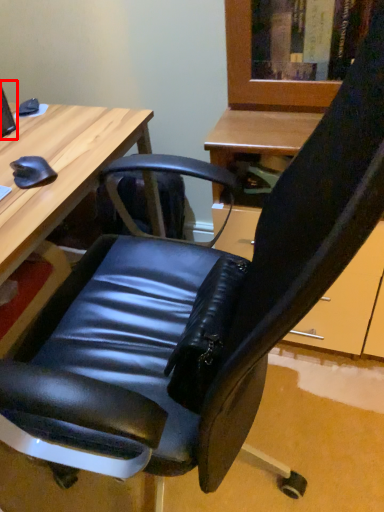
Question: Considering the relative positions of computer monitor (annotated by the red box) and desk in the image provided, where is computer monitor (annotated by the red box) located with respect to the staircase?

Choices:
 (A) right
 (B) left

Answer: (A)